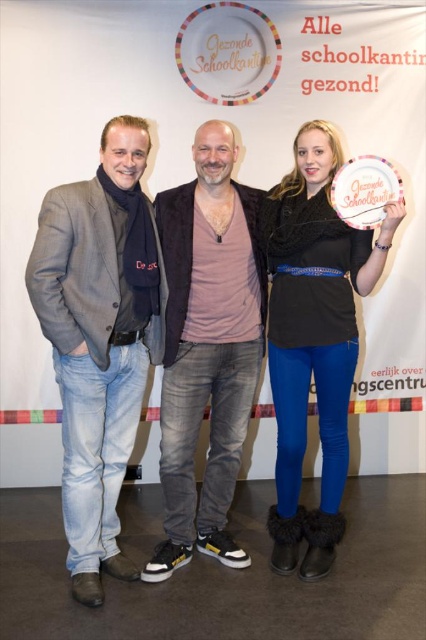
You are standing in front of the promotional backdrop for the healthy school canteen campaign. There are two points marked in the image at coordinates point (212,509) and point (293,296). If you were to walk towards the backdrop, which point would appear closer to you initially?

Point (212,509) is further to the camera than point (293,296), so when you are in front of the backdrop, point (212,509) would appear closer to you initially because it is positioned closer to the camera.

Looking at this image, you are a photographer setting up for a group photo. You notice the light blue denim jeans at left and the matte pink shirt at center. Which piece of clothing should you focus on first if you want to capture both in the frame without moving the camera? Explain your reasoning based on their sizes.

The light blue denim jeans at left is smaller than the matte pink shirt at center. Therefore, to ensure both are in frame without moving the camera, focus on the larger matte pink shirt at center first, as it occupies more space and will be easier to center initially. Adjust the framing to include the smaller light blue denim jeans at left afterward.

You are standing in front of the promotional backdrop for the school canteen initiative. You notice the individual wearing a matte pink shirt at center and the person on the left in a gray blazer. Based on their positions, which individual is closer to the camera?

The matte pink shirt at center is located at point (207, 348), which indicates it is closer to the camera than the person on the left in a gray blazer.